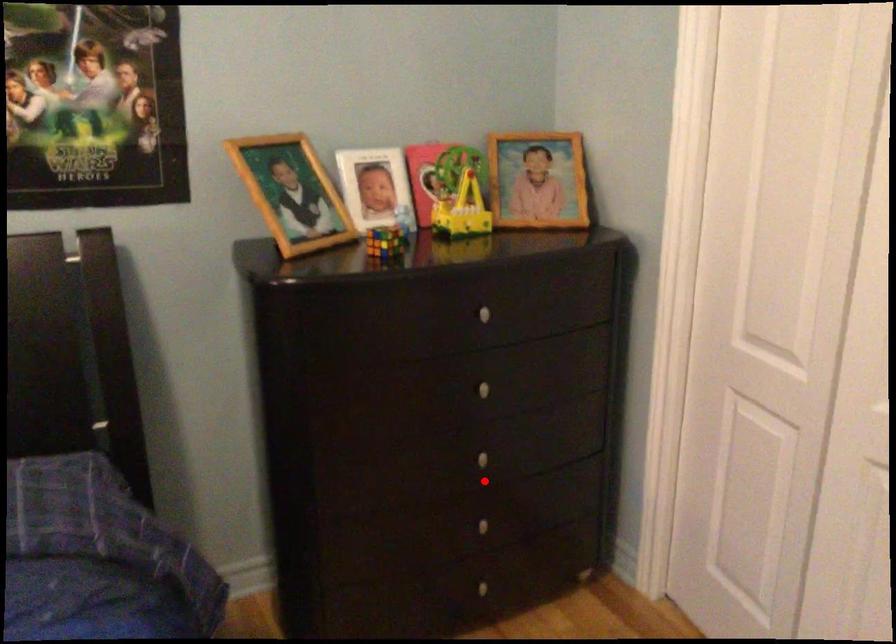
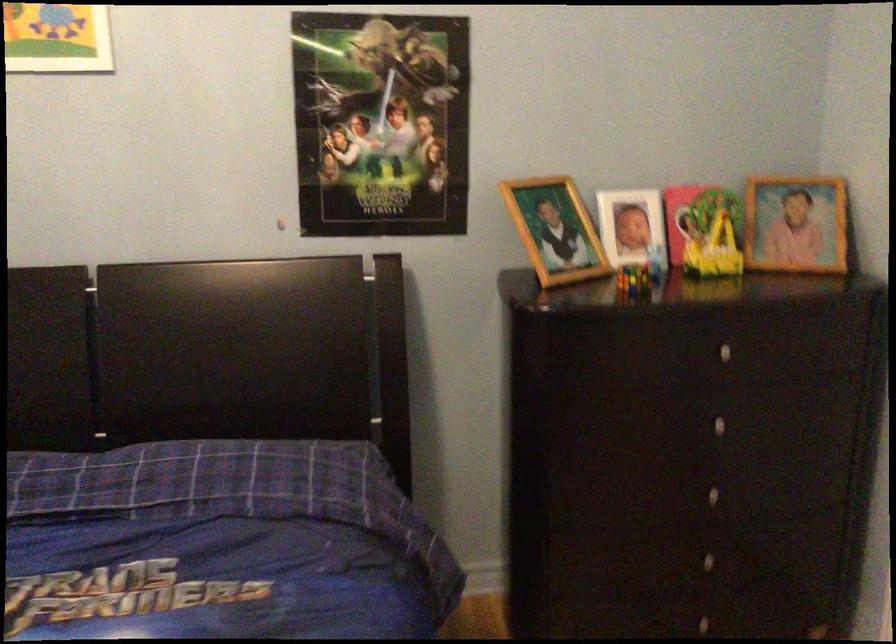
Locate, in the second image, the point that corresponds to the highlighted location in the first image.

(711, 516)